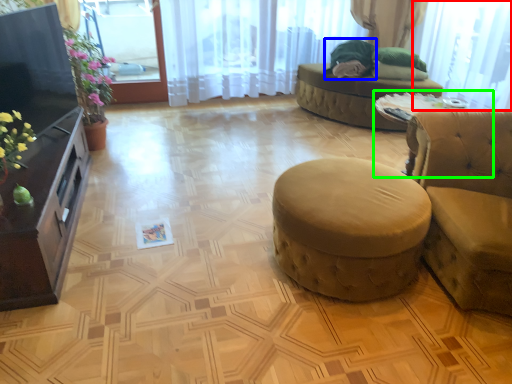
Question: Which object is the closest to the window screen (highlighted by a red box)? Choose among these: open (highlighted by a blue box) or round table (highlighted by a green box).

Choices:
 (A) open
 (B) round table

Answer: (B)